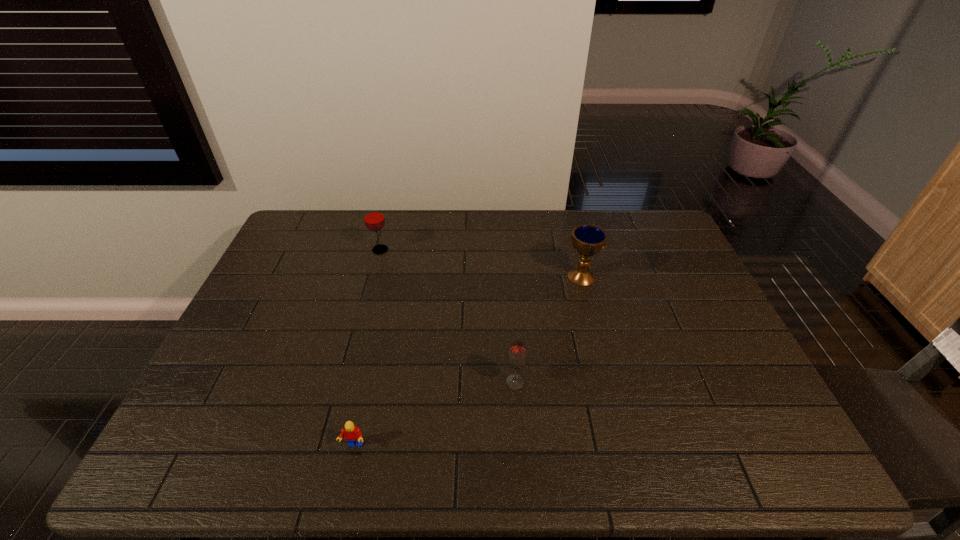
Image resolution: width=960 pixels, height=540 pixels. I want to click on vacant area situated 0.080m on the left of the third tallest object, so click(x=473, y=382).

At what (x,y) coordinates should I click in order to perform the action: click on object that is at the far edge. Please return your answer as a coordinate pair (x, y). The image size is (960, 540). Looking at the image, I should click on (374, 219).

This screenshot has width=960, height=540. Identify the location of object situated at the near edge. (352, 433).

Image resolution: width=960 pixels, height=540 pixels. Identify the location of free location at the far edge. (521, 215).

At what (x,y) coordinates should I click in order to perform the action: click on free space at the left edge of the desktop. Please return your answer as a coordinate pair (x, y). The height and width of the screenshot is (540, 960). Looking at the image, I should click on (239, 382).

Find the location of `free spot at the right edge of the desktop`. free spot at the right edge of the desktop is located at coordinates (742, 371).

Where is `blank space at the far left corner of the desktop`? The image size is (960, 540). blank space at the far left corner of the desktop is located at coordinates (300, 217).

This screenshot has width=960, height=540. Identify the location of empty space that is in between the rightmost object and the third farthest object. (548, 329).

This screenshot has width=960, height=540. I want to click on vacant space in between the left glass drink container and the nearest object, so click(367, 348).

Identify the location of vacant space that is in between the shortest object and the farther glass drink container. The height and width of the screenshot is (540, 960). (367, 348).